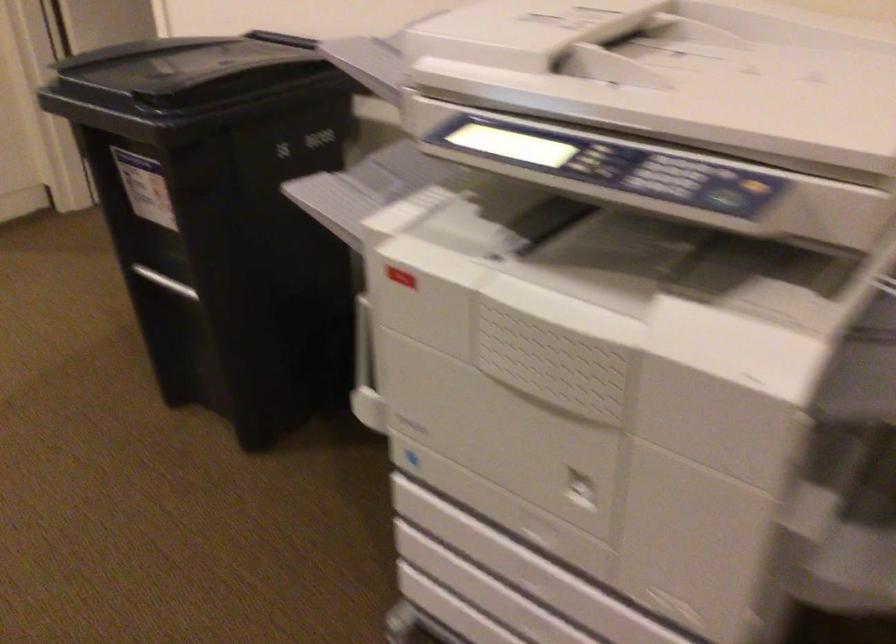
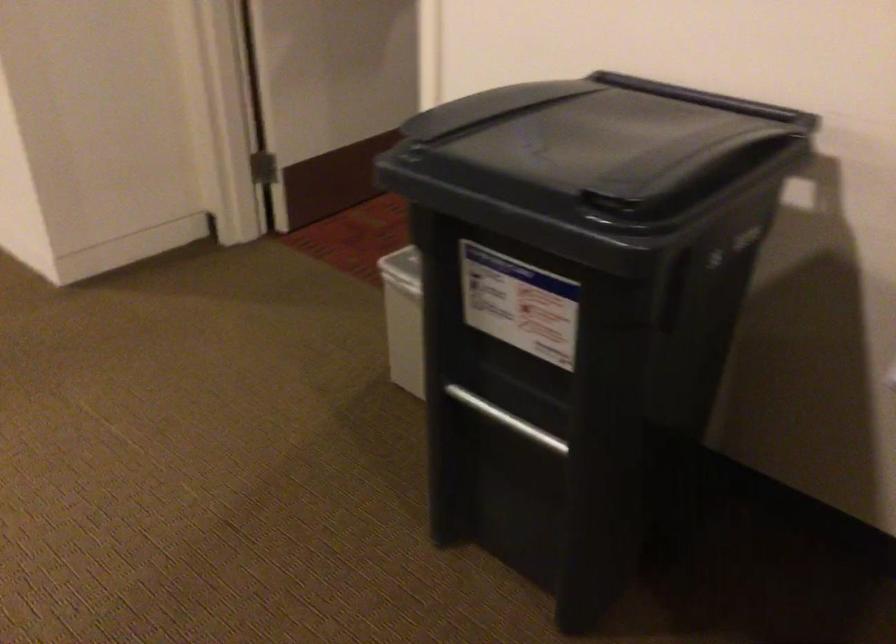
Which direction would the cameraman need to move to produce the second image?

The cameraman moved toward left, forward.